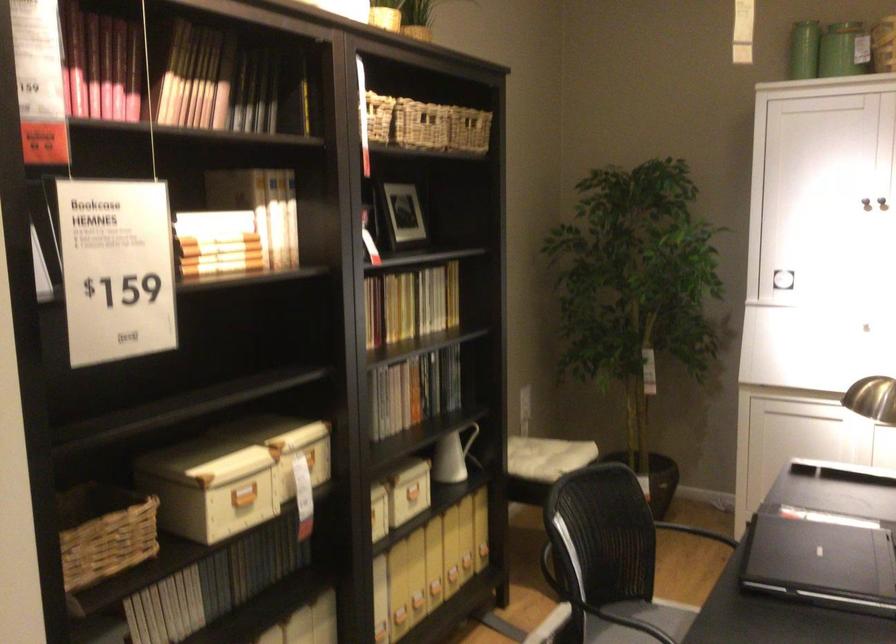
I want to click on chair armrest, so click(695, 532).